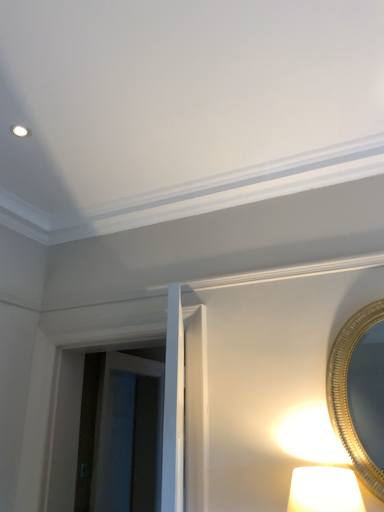
Find the location of a particular element. transparent glass door at center is located at coordinates (120, 434).

What is the approximate height of transparent glass door at center?

The height of transparent glass door at center is 1.29 meters.

Describe the element at coordinates (120, 434) in the screenshot. The width and height of the screenshot is (384, 512). I see `transparent glass door at center` at that location.

This screenshot has height=512, width=384. What do you see at coordinates (360, 393) in the screenshot?
I see `gold metallic mirror at right` at bounding box center [360, 393].

Locate an element on the screen. Image resolution: width=384 pixels, height=512 pixels. gold metallic mirror at right is located at coordinates (360, 393).

Measure the distance between point (379,318) and camera.

1.84 meters.

You are a GUI agent. You are given a task and a screenshot of the screen. Output one action in this format:
    pyautogui.click(x=<x>, y=<y>)
    Task: Click on the transparent glass door at center
    The width and height of the screenshot is (384, 512).
    Given the screenshot: What is the action you would take?
    pyautogui.click(x=120, y=434)

Is transparent glass door at center to the right of gold metallic mirror at right from the viewer's perspective?

Incorrect, transparent glass door at center is not on the right side of gold metallic mirror at right.

Which object is further away from the camera taking this photo, transparent glass door at center or gold metallic mirror at right?

transparent glass door at center is behind.

Is point (78, 493) closer or farther from the camera than point (358, 462)?

Point (78, 493).

From the image's perspective, is transparent glass door at center located above or below gold metallic mirror at right?

Based on their image positions, transparent glass door at center is located beneath gold metallic mirror at right.

From a real-world perspective, does transparent glass door at center sit lower than gold metallic mirror at right?

Yes.

Considering the sizes of objects transparent glass door at center and gold metallic mirror at right in the image provided, who is wider, transparent glass door at center or gold metallic mirror at right?

transparent glass door at center.

Who is shorter, transparent glass door at center or gold metallic mirror at right?

gold metallic mirror at right.

From the picture: Between transparent glass door at center and gold metallic mirror at right, which one has larger size?

transparent glass door at center.

Is transparent glass door at center inside the boundaries of gold metallic mirror at right, or outside?

transparent glass door at center exists outside the volume of gold metallic mirror at right.

Looking at this image, are transparent glass door at center and gold metallic mirror at right located far from each other?

That's right, there is a large distance between transparent glass door at center and gold metallic mirror at right.

Is transparent glass door at center facing away from gold metallic mirror at right?

That's not correct — transparent glass door at center is not looking away from gold metallic mirror at right.

Measure the distance from transparent glass door at center to gold metallic mirror at right.

transparent glass door at center is 6.98 feet from gold metallic mirror at right.

You are a GUI agent. You are given a task and a screenshot of the screen. Output one action in this format:
    pyautogui.click(x=<x>, y=<y>)
    Task: Click on the glass door below the gold metallic mirror at right (from the image's perspective)
    The height and width of the screenshot is (512, 384).
    Given the screenshot: What is the action you would take?
    pyautogui.click(x=120, y=434)

Which object is positioned more to the left, gold metallic mirror at right or transparent glass door at center?

transparent glass door at center.

Is gold metallic mirror at right in front of or behind transparent glass door at center in the image?

In the image, gold metallic mirror at right appears in front of transparent glass door at center.

Is point (346, 407) closer to viewer compared to point (103, 403)?

Yes, it is.

From the image's perspective, is gold metallic mirror at right above or below transparent glass door at center?

From the image's perspective, gold metallic mirror at right appears above transparent glass door at center.

Consider the image. From a real-world perspective, is gold metallic mirror at right physically above transparent glass door at center?

Yes, from a real-world perspective, gold metallic mirror at right is above transparent glass door at center.

In terms of width, does gold metallic mirror at right look wider or thinner when compared to transparent glass door at center?

In the image, gold metallic mirror at right appears to be more narrow than transparent glass door at center.

Between gold metallic mirror at right and transparent glass door at center, which one has more height?

transparent glass door at center.

Is gold metallic mirror at right bigger than transparent glass door at center?

Incorrect, gold metallic mirror at right is not larger than transparent glass door at center.

Is gold metallic mirror at right inside the boundaries of transparent glass door at center, or outside?

gold metallic mirror at right exists outside the volume of transparent glass door at center.

Is gold metallic mirror at right directly adjacent to transparent glass door at center?

They are not placed beside each other.

Consider the image. Is gold metallic mirror at right looking in the opposite direction of transparent glass door at center?

No, gold metallic mirror at right is not facing away from transparent glass door at center.

What's the angular difference between gold metallic mirror at right and transparent glass door at center's facing directions?

The angular difference between gold metallic mirror at right and transparent glass door at center is 90.3 degrees.

The height and width of the screenshot is (512, 384). In order to click on glass door that appears behind the gold metallic mirror at right in this screenshot , I will do `click(120, 434)`.

Find the location of a particular element. mirror in front of the transparent glass door at center is located at coordinates (360, 393).

Identify the location of glass door behind the gold metallic mirror at right. The width and height of the screenshot is (384, 512). (120, 434).